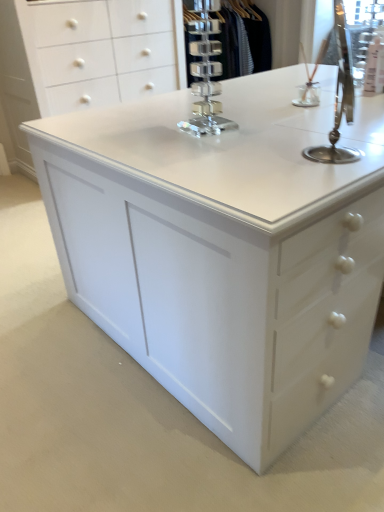
This screenshot has width=384, height=512. In order to click on silver metallic sewing machine at upper right in this screenshot , I will do `click(339, 99)`.

The image size is (384, 512). What do you see at coordinates (339, 99) in the screenshot? I see `silver metallic sewing machine at upper right` at bounding box center [339, 99].

This screenshot has width=384, height=512. I want to click on silver metallic sewing machine at upper right, so click(x=339, y=99).